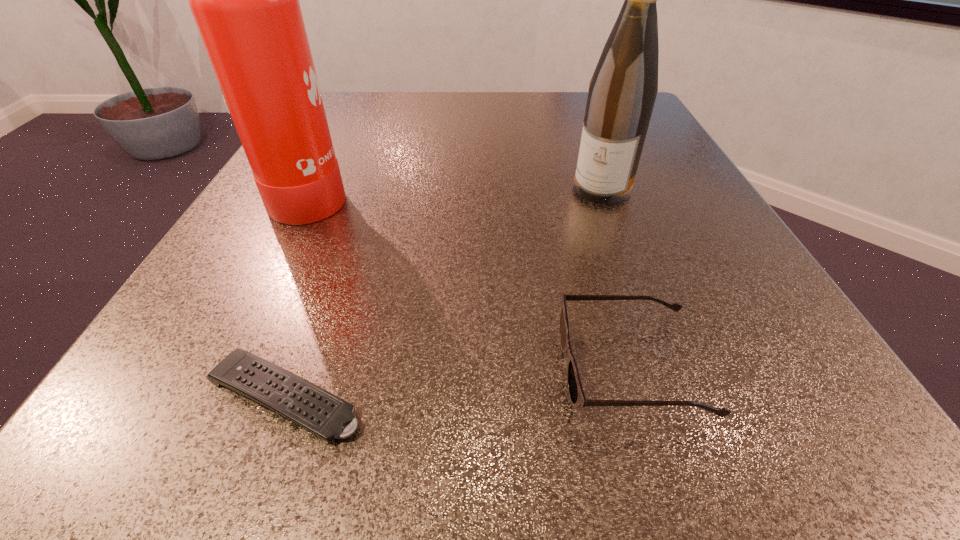
You are a GUI agent. You are given a task and a screenshot of the screen. Output one action in this format:
    pyautogui.click(x=<x>, y=<y>)
    Task: Click on the fire extinguisher
    Image resolution: width=960 pixels, height=540 pixels.
    Given the screenshot: What is the action you would take?
    pyautogui.click(x=245, y=0)

I want to click on wine bottle, so click(x=622, y=92).

Where is `the third tallest object`? The height and width of the screenshot is (540, 960). the third tallest object is located at coordinates (576, 394).

I want to click on the shortest object, so click(x=324, y=414).

Image resolution: width=960 pixels, height=540 pixels. Identify the location of vacant space located 0.310m towards the nozzle of the fire extinguisher. (528, 192).

Locate an element on the screen. vacant area situated on the front of the wine bottle is located at coordinates (641, 292).

At what (x,y) coordinates should I click in order to perform the action: click on free space located 0.340m on the front lenses of the third tallest object. Please return your answer as a coordinate pair (x, y). Image resolution: width=960 pixels, height=540 pixels. Looking at the image, I should click on (262, 368).

Find the location of `vacant space situated 0.110m on the front lenses of the third tallest object`. vacant space situated 0.110m on the front lenses of the third tallest object is located at coordinates (466, 368).

I want to click on vacant area situated 0.140m on the front lenses of the third tallest object, so click(440, 368).

Find the location of a particular element. The width and height of the screenshot is (960, 540). vacant point located 0.220m on the back of the remote control is located at coordinates (344, 238).